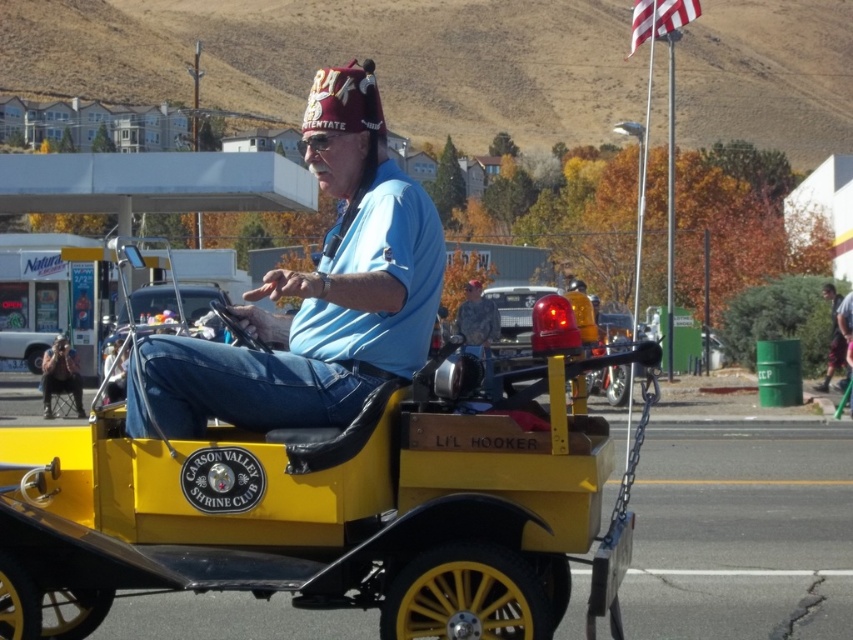
Is point (412, 236) farther from viewer compared to point (49, 404)?

That is False.

Find the location of a particular element. matte blue shirt at center is located at coordinates (321, 291).

Is point (432, 285) farther from viewer compared to point (44, 392)?

No, it is not.

Where is `matte blue shirt at center`? matte blue shirt at center is located at coordinates (321, 291).

Does yellow matte wagon at center appear under dark blue jeans at center?

Correct, yellow matte wagon at center is located below dark blue jeans at center.

Who is more distant from viewer, (645, 344) or (833, 284)?

Point (833, 284)

Who is more distant from viewer, (215, 531) or (839, 348)?

The point (839, 348) is more distant.

Where is `yellow matte wagon at center`? yellow matte wagon at center is located at coordinates (337, 504).

From the picture: Is yellow matte wagon at center positioned behind matte blue shirt at center?

Yes, it is.

Does yellow matte wagon at center have a greater width compared to matte blue shirt at center?

Yes.

What do you see at coordinates (337, 504) in the screenshot? The image size is (853, 640). I see `yellow matte wagon at center` at bounding box center [337, 504].

In order to click on yellow matte wagon at center in this screenshot , I will do `click(337, 504)`.